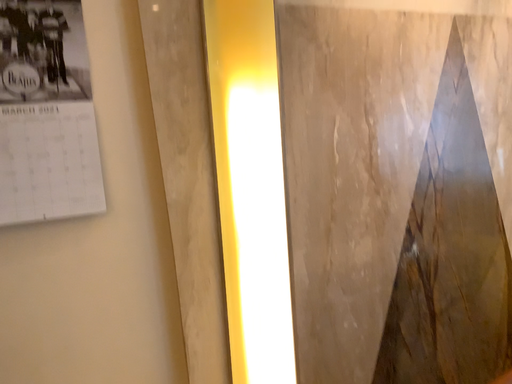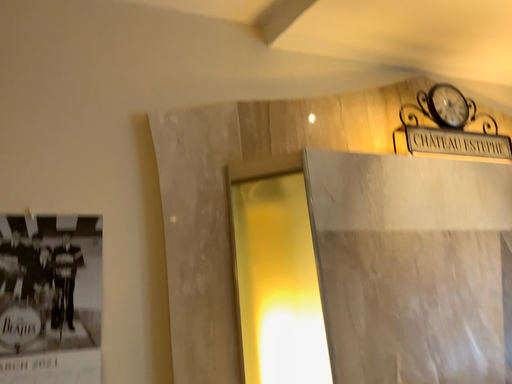
Question: How did the camera likely rotate when shooting the video?

Choices:
 (A) rotated downward
 (B) rotated upward

Answer: (B)